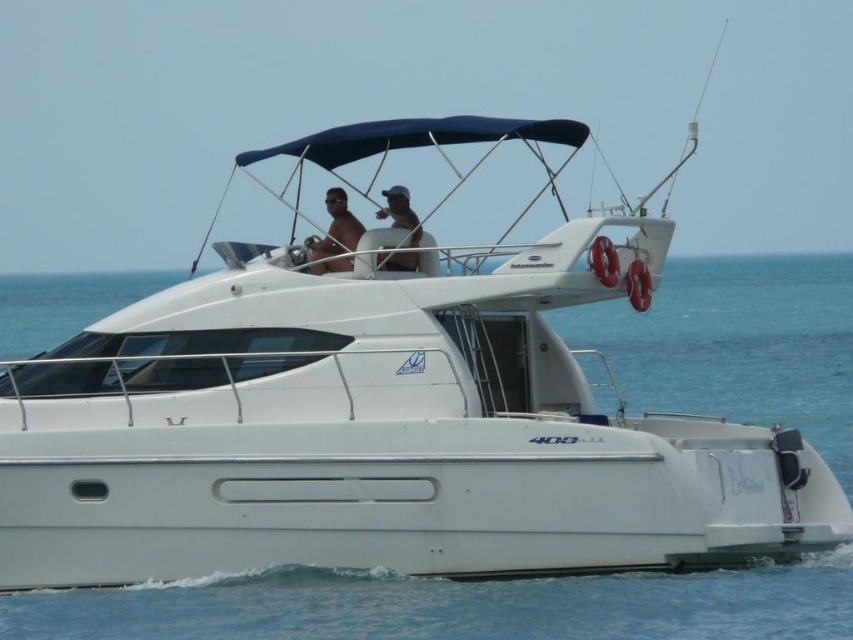
You are a photographer on the deck of the white motor yacht named Intermarine 400. You notice a point at coordinates (335, 228) which is part of an object on the yacht. What object is located at that point?

The point at coordinates (335, 228) corresponds to the matte white shirt at upper center.

You are a photographer on the deck of the yacht and want to capture both the matte white shirt at upper center and the matte white cap at upper center in a single frame. Since your camera has a fixed focus, you need to know which object is wider to adjust the framing properly. Which one is wider?

The matte white shirt at upper center is wider than the matte white cap at upper center according to the description.

You are a photographer on the deck of the yacht and want to capture both the matte white shirt at upper center and the matte white cap at upper center in a single frame. Since your camera has a fixed focus, you need to ensure both objects are within the focal range. Given that the shirt is smaller than the cap, which object should you focus on to maximize the chances of both being in focus?

The matte white shirt at upper center is smaller than the matte white cap at upper center. To maximize the chances of both being in focus, you should focus on the matte white shirt at upper center because smaller objects generally require focusing on them to ensure sharpness when paired with larger objects in the same frame.